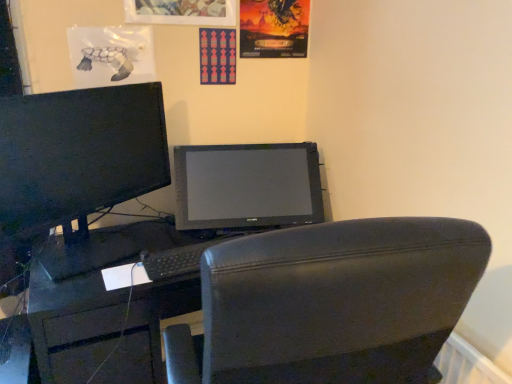
Question: In the image, is matte black monitor at left positioned in front of or behind black matte keyboard at center?

Choices:
 (A) behind
 (B) front

Answer: (B)

Question: From the image's perspective, relative to black matte keyboard at center, is matte black monitor at left above or below?

Choices:
 (A) below
 (B) above

Answer: (B)

Question: Estimate the real-world distances between objects in this image. Which object is farther from the black matte desk at center?

Choices:
 (A) matte paper poster at upper center, which appears as the first poster page when viewed from the right
 (B) black matte keyboard at center
 (C) matte pink poster at upper center, which is the first poster page from left to right
 (D) matte black monitor at left
 (E) black leather chair at center

Answer: (A)

Question: Estimate the real-world distances between objects in this image. Which object is closer to the matte black monitor at left?

Choices:
 (A) black leather chair at center
 (B) matte pink poster at upper center, marked as the 2th poster page in a right-to-left arrangement
 (C) black matte desk at center
 (D) matte paper poster at upper center, marked as the 2th poster page in a left-to-right arrangement
 (E) black matte keyboard at center

Answer: (E)